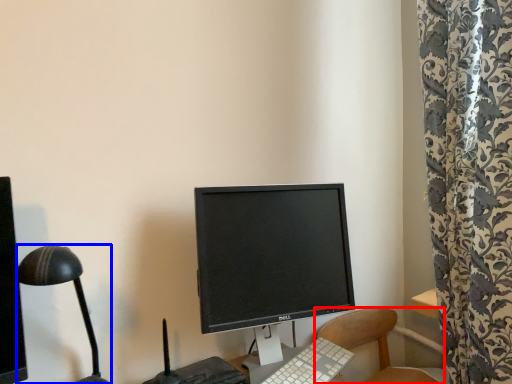
Question: Which object appears farthest to the camera in this image, chair (highlighted by a red box) or lamp (highlighted by a blue box)?

Choices:
 (A) chair
 (B) lamp

Answer: (A)